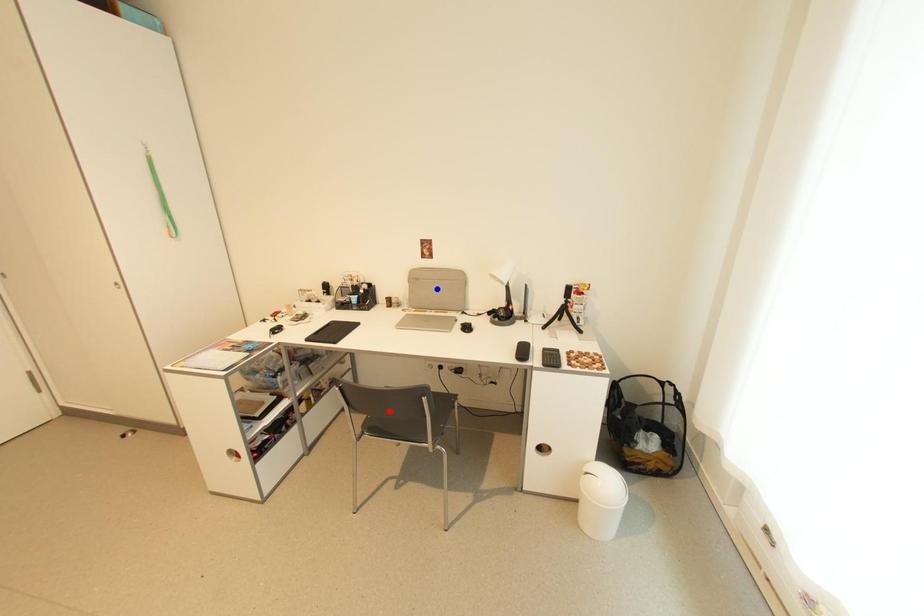
Question: In the image, two points are highlighted. Which point is nearer to the camera? Reply with the corresponding letter.

Choices:
 (A) blue point
 (B) red point

Answer: (B)